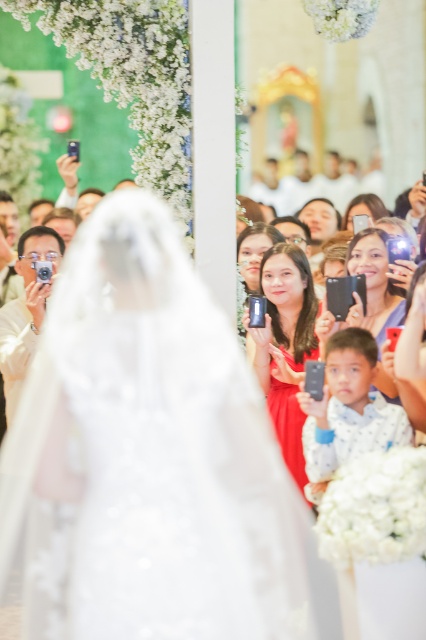
Is shiny red dress at center shorter than matte black phone at upper center?

In fact, shiny red dress at center may be taller than matte black phone at upper center.

Is shiny red dress at center further to the viewer compared to matte black phone at upper center?

No, shiny red dress at center is in front of matte black phone at upper center.

What do you see at coordinates (285, 346) in the screenshot? The image size is (426, 640). I see `shiny red dress at center` at bounding box center [285, 346].

Where is `shiny red dress at center`? shiny red dress at center is located at coordinates (285, 346).

Does white lace veil at center have a greater height compared to matte black phone at center?

Correct, white lace veil at center is much taller as matte black phone at center.

Who is more distant from viewer, (x=207, y=467) or (x=380, y=324)?

The point (x=380, y=324) is more distant.

Where is `white lace veil at center`? This screenshot has height=640, width=426. white lace veil at center is located at coordinates (150, 460).

Does point (385, 276) come in front of point (376, 196)?

Yes, it is in front of point (376, 196).

Is matte black phone at center bigger than matte black phone at upper center?

Yes.

Locate an element on the screen. The height and width of the screenshot is (640, 426). matte black phone at center is located at coordinates (367, 289).

At what (x,y) coordinates should I click in order to perform the action: click on matte black phone at center. Please return your answer as a coordinate pair (x, y). This screenshot has width=426, height=640. Looking at the image, I should click on (367, 289).